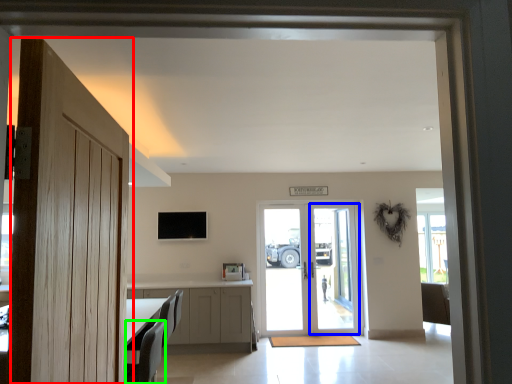
Question: Based on their relative distances, which object is nearer to door (highlighted by a red box)? Choose from screen door (highlighted by a blue box) and armchair (highlighted by a green box).

Choices:
 (A) screen door
 (B) armchair

Answer: (B)